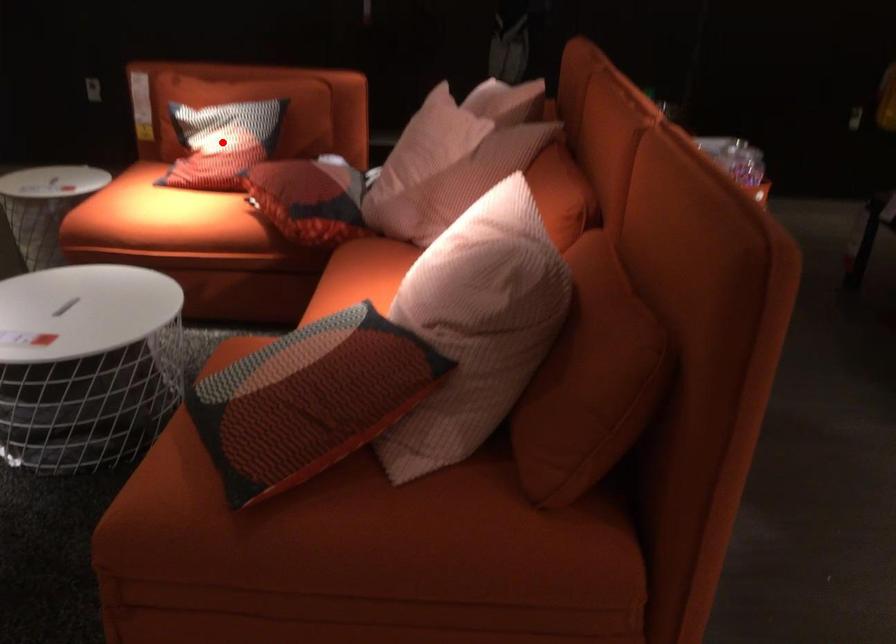
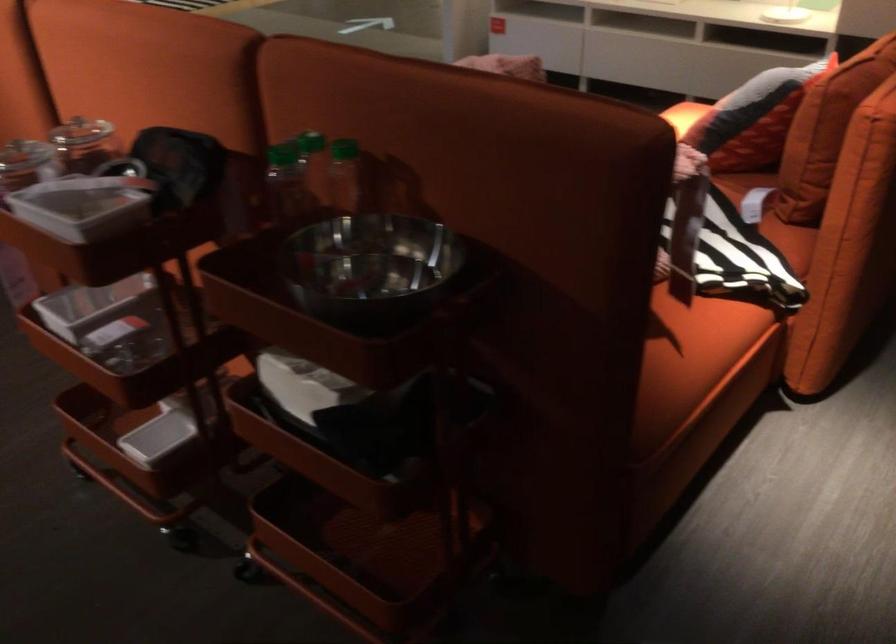
Question: I am providing you with two images of the same scene from different viewpoints. A red point is marked on the first image. At the location where the point appears in image 1, is it still visible in image 2?

Choices:
 (A) Yes
 (B) No

Answer: (B)